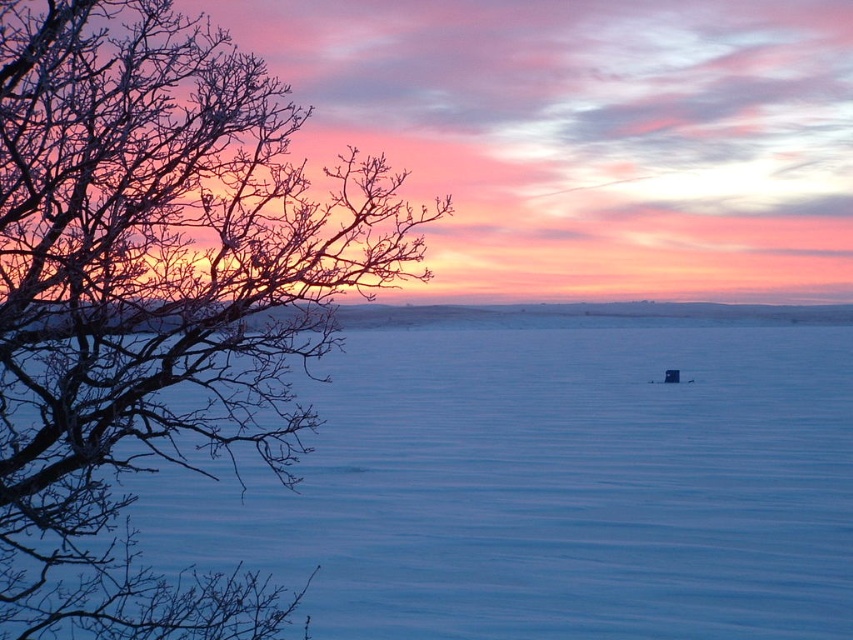
Based on the scene, which object is positioned lower in the image? The smooth ice at center or the bare branches at left?

The smooth ice at center is located below the bare branches at left, so it is positioned lower in the image.

You are standing in the winter landscape and want to walk from point A to point B. Point A is at coordinate point (x=833, y=426) and point B is at coordinate point (x=169, y=60). Which direction should you face to walk towards point B from point A?

To walk from point A at coordinate point (x=833, y=426) to point B at coordinate point (x=169, y=60), you should face towards the lower left direction since point B is located to the lower left of point A.